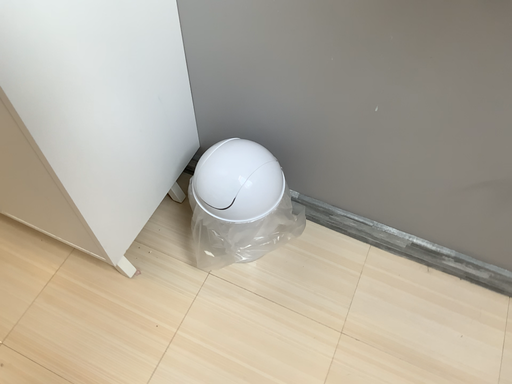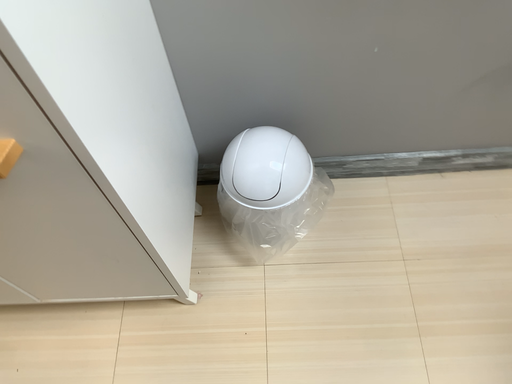
Question: Which way did the camera rotate in the video?

Choices:
 (A) rotated left
 (B) rotated right

Answer: (B)